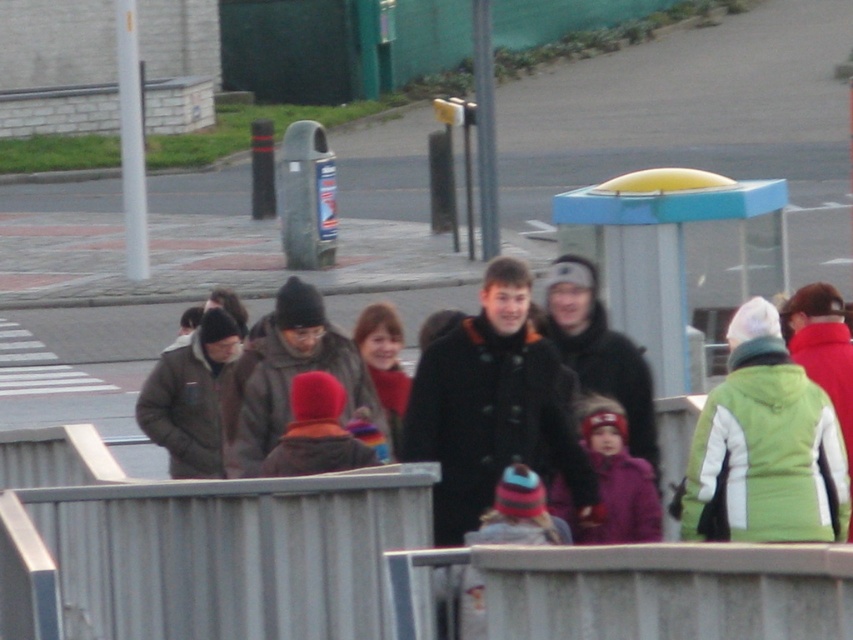
You are a delivery person who needs to place a large package between the gray metallic rail at center and the blue plastic bus stop at center. Which object should you move to make space?

The gray metallic rail at center has a smaller size compared to the blue plastic bus stop at center, so you should move the gray metallic rail at center to make space for the large package.

You are a delivery person who needs to place a package on the gray metallic rail at center. You are currently holding the package and standing near the black wool coat at center. Can you reach the rail without moving your feet?

The gray metallic rail at center is 7.78 feet from the black wool coat at center. Since you are standing near the black wool coat at center, you would need to move your feet to reach the rail, as 7.78 feet is beyond typical arm reach.

You are a photographer trying to capture a photo of the red knit hat at center. To get a clear shot, you need to ensure the metallic gray rail at lower center doesn not block the view. Based on their positions, can you position yourself so that the rail is not in the way of the hat?

The metallic gray rail at lower center is located below the red knit hat at center, so if you position yourself to aim slightly above the rail, the hat will be visible without obstruction.